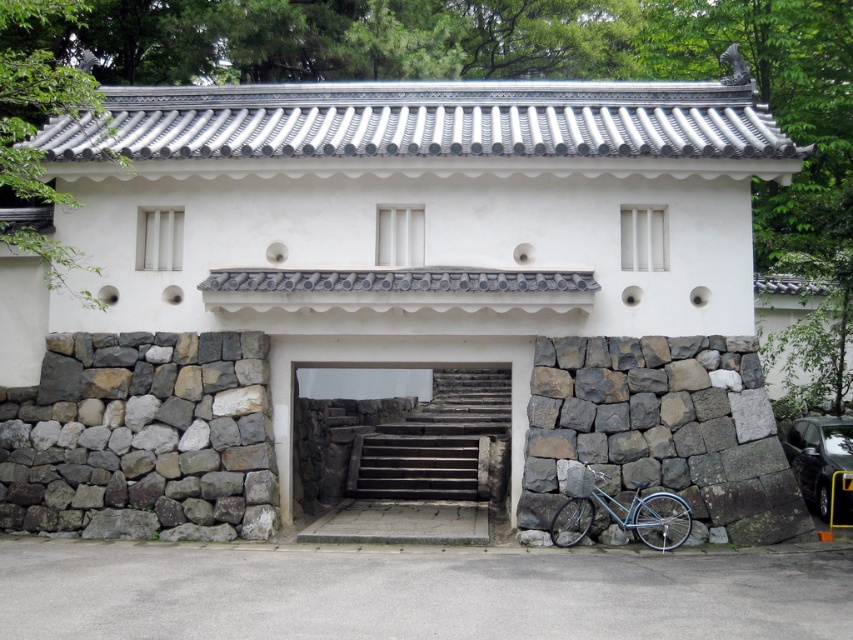
You are standing in front of the traditional Japanese building and want to take a photo. There are two points marked on the entrance area. The first point is at coordinate point [523,385] and the second is at point [593,499]. Which point is closer to your camera when you take the photo?

Point [523,385] is further to the camera than point [593,499], so the second point is closer to the camera.

You are standing in front of the traditional Japanese building and want to enter through the entrance. Which object, the stone stairs at center or the metallic blue bicycle at lower right, is closer to you as you approach the entrance?

The stone stairs at center is closer to you than the metallic blue bicycle at lower right because it is further to the viewer.

Looking at this image, you are standing at the entrance of the traditional Japanese building and want to go up the stone stairs at center. The gray stone wall at lower right is blocking your path. Can you walk around it to reach the stairs?

The gray stone wall at lower right is 6.24 feet from the stone stairs at center, so you can walk around the gray stone wall at lower right to reach the stone stairs at center since there is enough space between them.